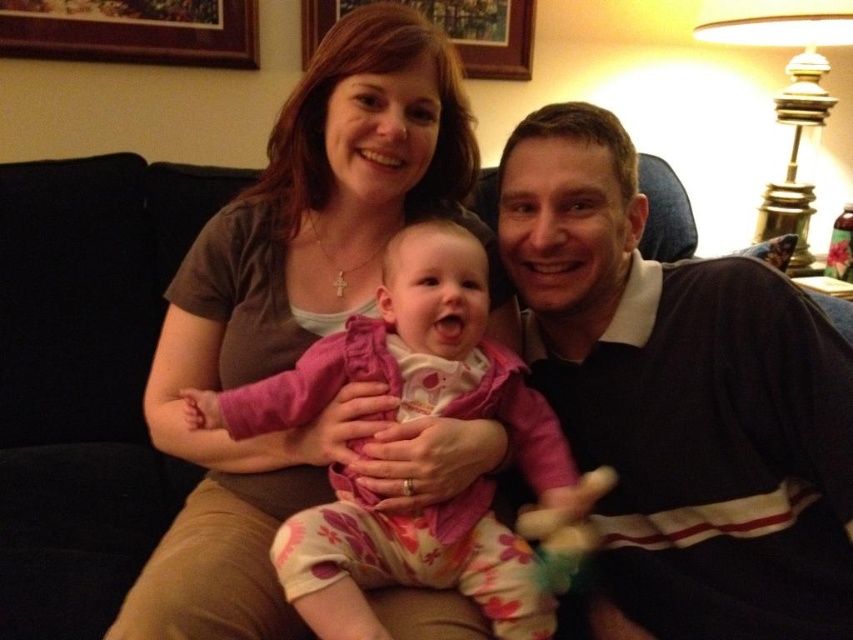
Between point (587, 433) and point (387, 288), which one is positioned in front?

Point (387, 288)

Looking at this image, who is more distant from viewer, (x=711, y=451) or (x=469, y=355)?

The point (x=469, y=355) is more distant.

I want to click on dark brown jersey at right, so click(x=682, y=397).

Where is `dark brown jersey at right`? Image resolution: width=853 pixels, height=640 pixels. dark brown jersey at right is located at coordinates (682, 397).

Between point (407, 538) and point (581, 518), which one is positioned behind?

Point (581, 518)

Based on the photo, can you confirm if pink fleece baby at center is positioned to the right of plush pink toy at center?

No, pink fleece baby at center is not to the right of plush pink toy at center.

Who is more distant from viewer, (479, 515) or (572, 541)?

The point (479, 515) is behind.

The width and height of the screenshot is (853, 640). I want to click on pink fleece baby at center, so click(415, 362).

Is dark brown jersey at right further to the viewer compared to plush pink toy at center?

No, dark brown jersey at right is closer to the viewer.

Locate an element on the screen. Image resolution: width=853 pixels, height=640 pixels. dark brown jersey at right is located at coordinates (682, 397).

The height and width of the screenshot is (640, 853). I want to click on dark brown jersey at right, so point(682,397).

At what (x,y) coordinates should I click in order to perform the action: click on dark brown jersey at right. Please return your answer as a coordinate pair (x, y). Looking at the image, I should click on (682, 397).